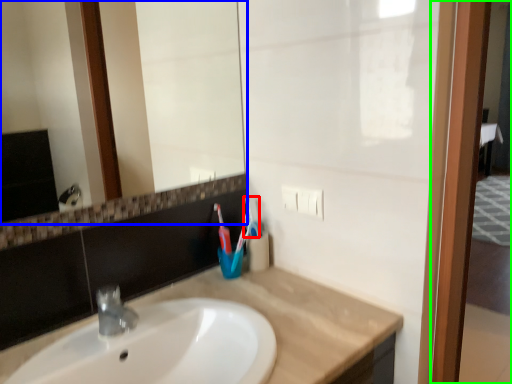
Question: Estimate the real-world distances between objects in this image. Which object is farther from toothbrush (highlighted by a red box), mirror (highlighted by a blue box) or screen door (highlighted by a green box)?

Choices:
 (A) mirror
 (B) screen door

Answer: (A)